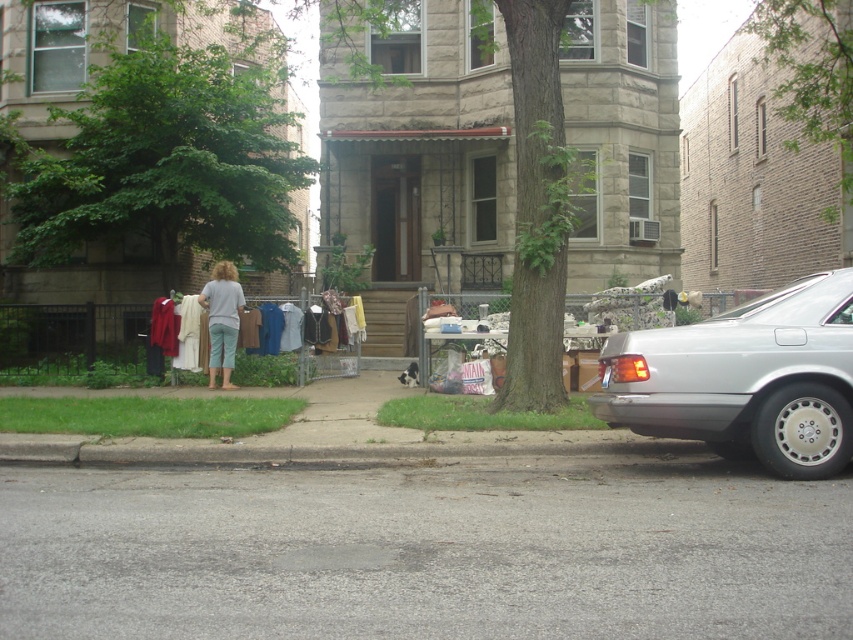
Which of these two, gray asphalt pavement at lower center or white cotton shirts at center, stands shorter?

With less height is gray asphalt pavement at lower center.

Based on the photo, is gray asphalt pavement at lower center below white cotton shirts at center?

Correct, gray asphalt pavement at lower center is located below white cotton shirts at center.

Find the location of `gray asphalt pavement at lower center`. gray asphalt pavement at lower center is located at coordinates (426, 550).

Locate an element on the screen. gray asphalt pavement at lower center is located at coordinates (426, 550).

Based on the photo, is gray asphalt pavement at lower center closer to camera compared to green leafy tree at upper right?

That is True.

Who is higher up, gray asphalt pavement at lower center or green leafy tree at upper right?

green leafy tree at upper right

Between point (492, 595) and point (807, 90), which one is positioned in front?

Point (492, 595)

This screenshot has height=640, width=853. I want to click on gray asphalt pavement at lower center, so click(x=426, y=550).

Does green leafy tree at center appear on the right side of green leafy tree at upper right?

No, green leafy tree at center is not to the right of green leafy tree at upper right.

Is green leafy tree at center taller than green leafy tree at upper right?

Correct, green leafy tree at center is much taller as green leafy tree at upper right.

Is point (524, 161) positioned behind point (828, 141)?

That is False.

Identify the location of green leafy tree at center. The width and height of the screenshot is (853, 640). (503, 148).